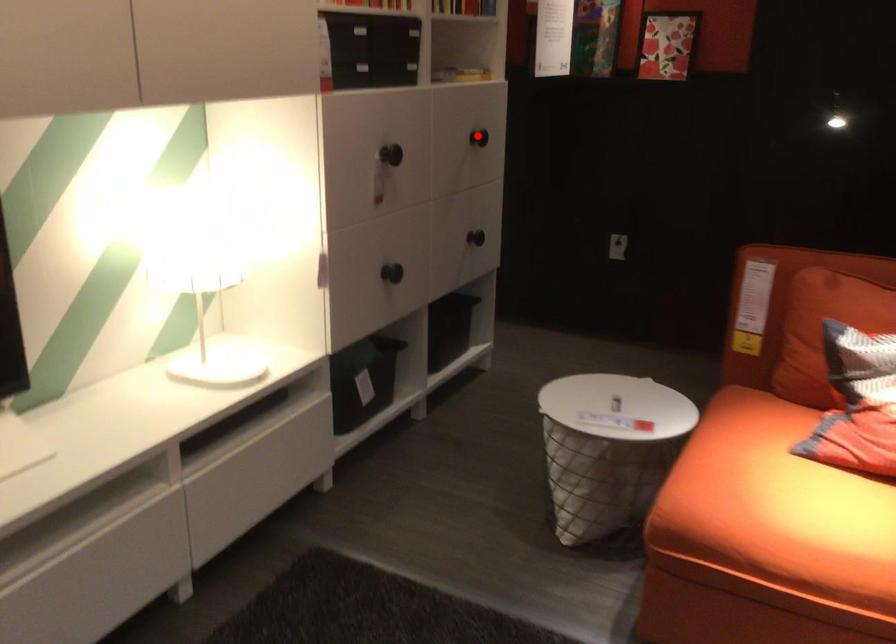
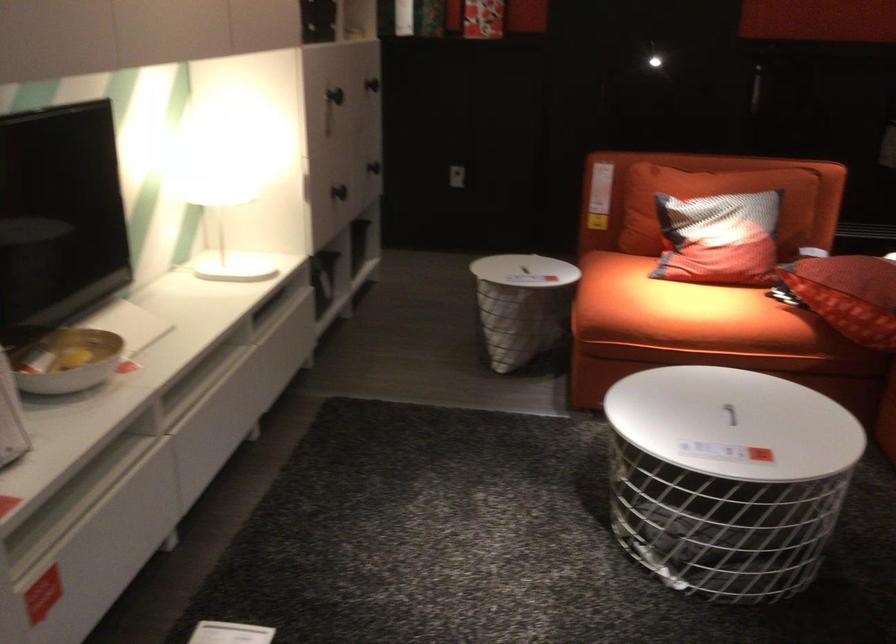
In the second image, find the point that corresponds to the highlighted location in the first image.

(372, 84)